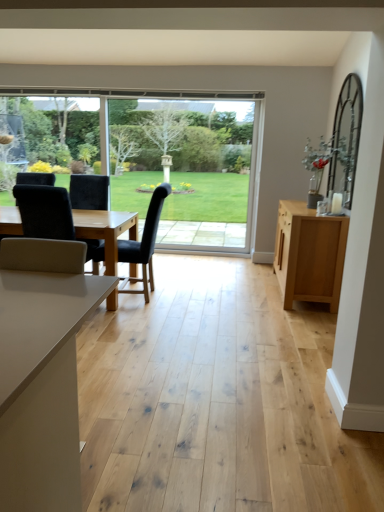
You are a GUI agent. You are given a task and a screenshot of the screen. Output one action in this format:
    pyautogui.click(x=<x>, y=<y>)
    Task: Click on the vacant area that is in front of black fabric chair at center, the 1th chair when ordered from right to left
    The image size is (384, 512).
    Given the screenshot: What is the action you would take?
    pyautogui.click(x=145, y=314)